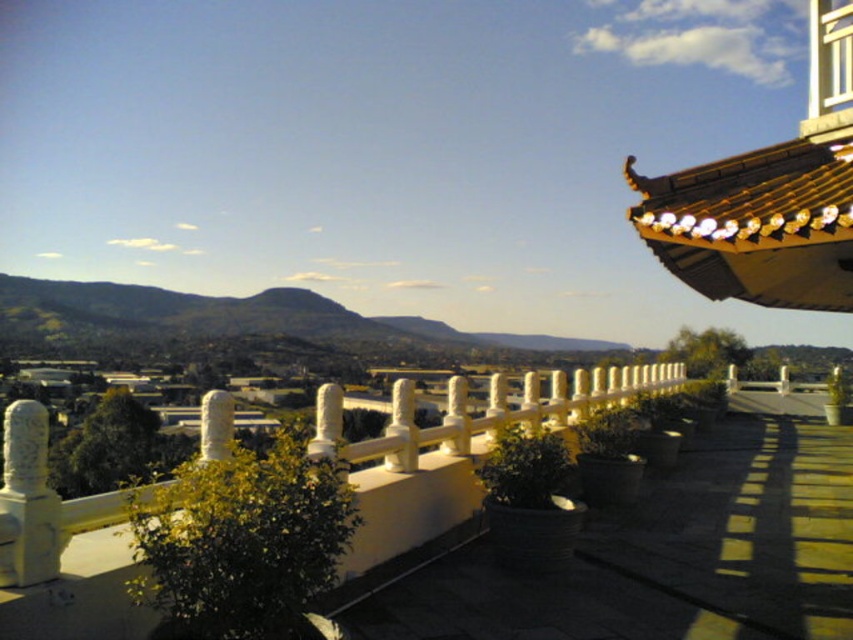
Question: Is white stone pillar at left further to camera compared to white stone pillar at center?

Choices:
 (A) yes
 (B) no

Answer: (B)

Question: Among these objects, which one is nearest to the camera?

Choices:
 (A) white stone pillar at center
 (B) white stone pillar at left

Answer: (B)

Question: Which point is farther to the camera?

Choices:
 (A) (42, 467)
 (B) (209, 458)

Answer: (B)

Question: Does white stone pillar at left appear on the left side of white stone pillar at center?

Choices:
 (A) yes
 (B) no

Answer: (A)

Question: Which object appears closest to the camera in this image?

Choices:
 (A) white stone pillar at left
 (B) white stone pillar at center

Answer: (A)

Question: In this image, where is white stone pillar at left located relative to white stone pillar at center?

Choices:
 (A) left
 (B) right

Answer: (A)